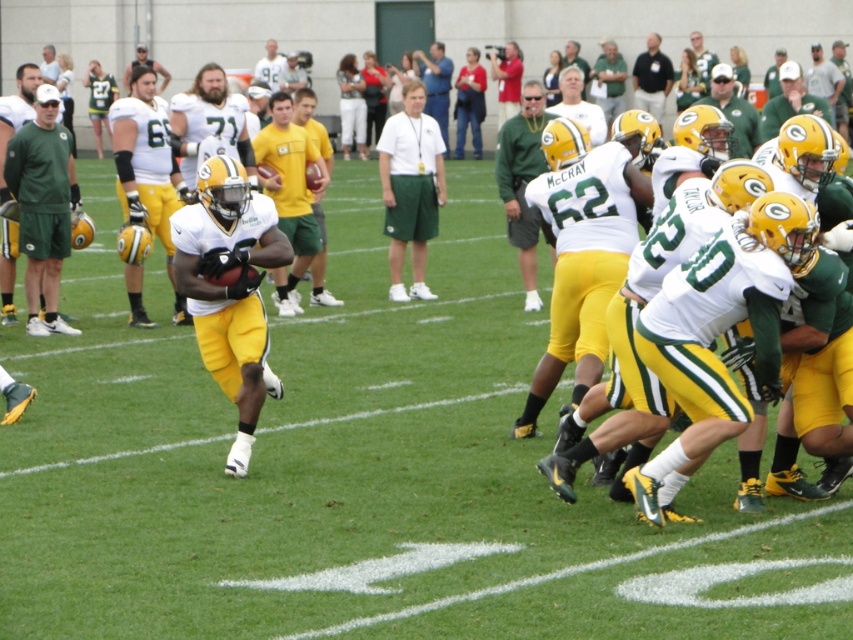
You are a coach analyzing the players during a practice session. You notice two points marked on the field. The first point is at coordinate point(519, 168) and the second is at point(428, 60). Which point is closer to the player with jersey number 62?

Point(519, 168) is in front of point(428, 60), so the first point is closer to the player with jersey number 62.

You are a photographer positioned at the center of the field. You want to take a photo that includes both the green matte shorts at left and the white shirt at upper left. Which object should you adjust your camera angle to focus on first to ensure both are in frame?

The green matte shorts at left is in front of the white shirt at upper left, so you should focus on the green matte shorts at left first to ensure both are visible in the photo.

You are a photographer standing at the center of the field. You want to take a photo of the green matte shorts at left. Where should you point your camera?

The green matte shorts at left are located at point (42, 205), so you should point your camera towards that coordinate.